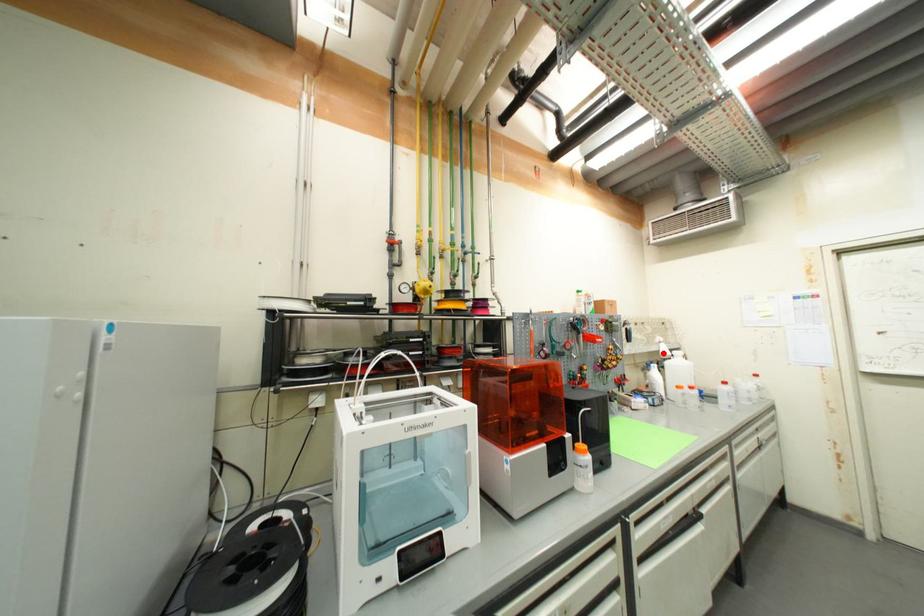
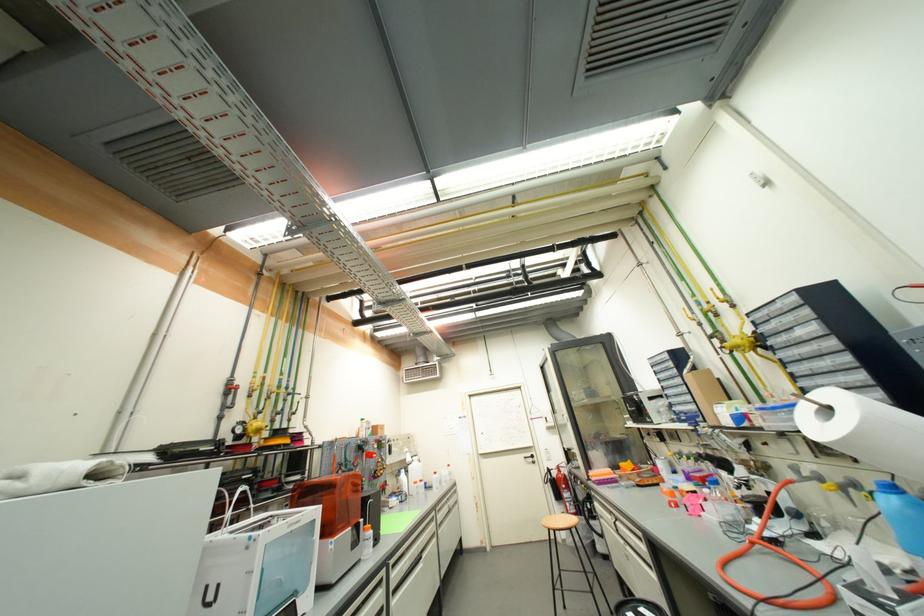
Question: I am providing you with two images of the same scene from different viewpoints. A red point is shown in image1. For the corresponding object point in image2, is it positioned nearer or farther from the camera?

Choices:
 (A) Nearer
 (B) Farther

Answer: (B)